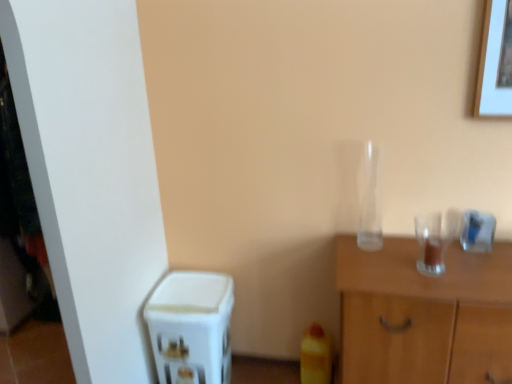
Identify the location of empty space that is ontop of transparent glass cabinet at right (from a real-world perspective). Image resolution: width=512 pixels, height=384 pixels. (433, 261).